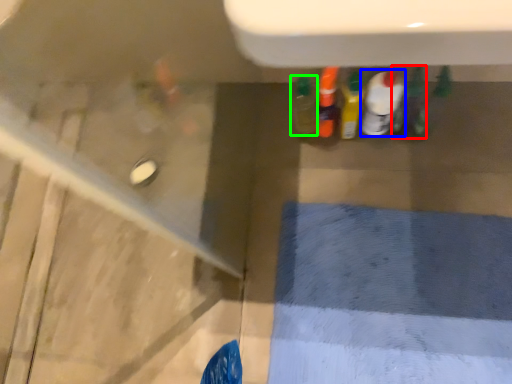
Question: Which is nearer to the bottle (highlighted by a red box)? bottle (highlighted by a blue box) or bottle (highlighted by a green box).

Choices:
 (A) bottle
 (B) bottle

Answer: (A)